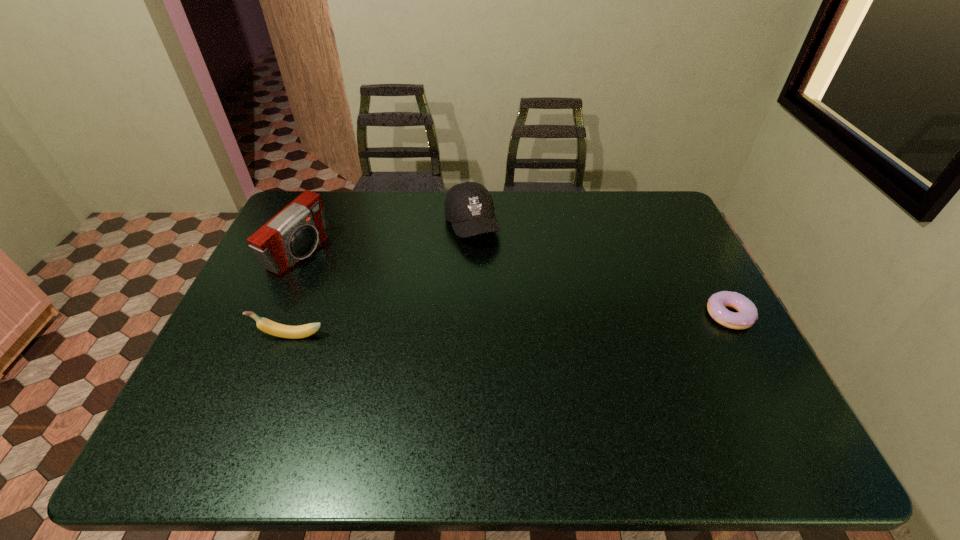
Find the location of a particular element. Image resolution: width=960 pixels, height=540 pixels. empty space between the tallest object and the doughnut is located at coordinates (514, 285).

Where is `vacant area that lies between the second object from right to left and the tallest object`? vacant area that lies between the second object from right to left and the tallest object is located at coordinates (385, 239).

Locate an element on the screen. The height and width of the screenshot is (540, 960). free space between the baseball cap and the doughnut is located at coordinates (600, 270).

The width and height of the screenshot is (960, 540). In order to click on vacant region between the baseball cap and the rightmost object in this screenshot , I will do `click(600, 270)`.

Where is `empty space between the camera and the rightmost object`? empty space between the camera and the rightmost object is located at coordinates (514, 285).

Where is `object that is the third closest to the banana`? Image resolution: width=960 pixels, height=540 pixels. object that is the third closest to the banana is located at coordinates (747, 314).

The height and width of the screenshot is (540, 960). What are the coordinates of `object that is the closest to the shortest object` in the screenshot? It's located at (469, 207).